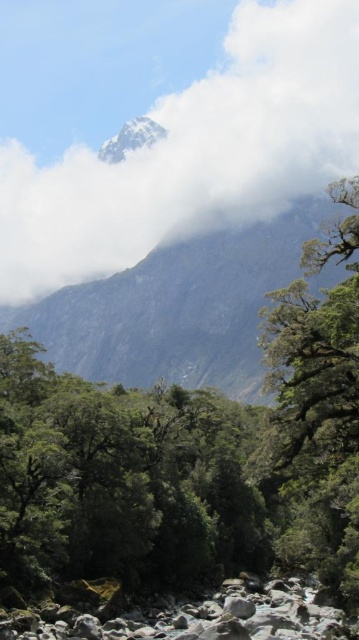
Question: Is white fluffy cloud at upper center to the left of rocky gray mountain at upper center from the viewer's perspective?

Choices:
 (A) no
 (B) yes

Answer: (B)

Question: Is white fluffy cloud at upper center closer to camera compared to rocky gray mountain at upper center?

Choices:
 (A) no
 (B) yes

Answer: (A)

Question: Which point appears farthest from the camera in this image?

Choices:
 (A) (327, 216)
 (B) (91, 202)

Answer: (B)

Question: Can you confirm if white fluffy cloud at upper center is bigger than rocky gray mountain at upper center?

Choices:
 (A) no
 (B) yes

Answer: (B)

Question: Which of the following is the farthest from the observer?

Choices:
 (A) (142, 209)
 (B) (277, 285)

Answer: (A)

Question: Which object is farther from the camera taking this photo?

Choices:
 (A) white fluffy cloud at upper center
 (B) rocky gray mountain at upper center

Answer: (A)